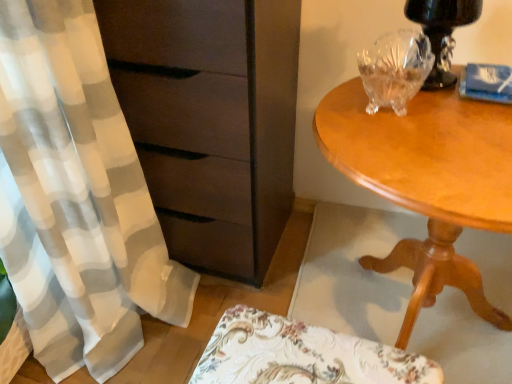
You are a GUI agent. You are given a task and a screenshot of the screen. Output one action in this format:
    pyautogui.click(x=<x>, y=<y>)
    Task: Click on the black glossy table lamp at upper right
    
    Given the screenshot: What is the action you would take?
    pyautogui.click(x=442, y=32)

What is the approximate width of floral fabric cushion at lower center?

floral fabric cushion at lower center is 17.35 centimeters in width.

What do you see at coordinates (426, 182) in the screenshot?
I see `light brown wood table at right` at bounding box center [426, 182].

Describe the element at coordinates (395, 69) in the screenshot. The height and width of the screenshot is (384, 512). I see `transparent crystal bowl at upper right` at that location.

Where is `black glossy table lamp at upper right`? This screenshot has height=384, width=512. black glossy table lamp at upper right is located at coordinates (442, 32).

Can you confirm if matte brown chest of drawers at left is smaller than floral fabric cushion at lower center?

No, matte brown chest of drawers at left is not smaller than floral fabric cushion at lower center.

Is matte brown chest of drawers at left directly adjacent to floral fabric cushion at lower center?

No, matte brown chest of drawers at left is not making contact with floral fabric cushion at lower center.

From a real-world perspective, who is located lower, matte brown chest of drawers at left or floral fabric cushion at lower center?

floral fabric cushion at lower center.

From a real-world perspective, is transparent crystal bowl at upper right above or below light brown wood table at right?

Clearly, from a real-world perspective, transparent crystal bowl at upper right is above light brown wood table at right.

Considering the sizes of objects transparent crystal bowl at upper right and light brown wood table at right in the image provided, who is bigger, transparent crystal bowl at upper right or light brown wood table at right?

light brown wood table at right is bigger.

Can you confirm if transparent crystal bowl at upper right is taller than light brown wood table at right?

In fact, transparent crystal bowl at upper right may be shorter than light brown wood table at right.

Find the location of `chest of drawers on the left of black glossy table lamp at upper right`. chest of drawers on the left of black glossy table lamp at upper right is located at coordinates (211, 121).

Based on the photo, does black glossy table lamp at upper right have a larger size compared to matte brown chest of drawers at left?

No.

Is black glossy table lamp at upper right positioned beyond the bounds of matte brown chest of drawers at left?

Absolutely, black glossy table lamp at upper right is external to matte brown chest of drawers at left.

Locate an element on the screen. This screenshot has width=512, height=384. table lamp above the floral fabric cushion at lower center (from the image's perspective) is located at coordinates (442, 32).

Is point (219, 369) less distant than point (413, 19)?

Yes.

Consider the image. Is floral fabric cushion at lower center spatially inside black glossy table lamp at upper right, or outside of it?

floral fabric cushion at lower center is located beyond the bounds of black glossy table lamp at upper right.

From the image's perspective, relative to black glossy table lamp at upper right, is floral fabric cushion at lower center above or below?

Clearly, from the image's perspective, floral fabric cushion at lower center is below black glossy table lamp at upper right.

Does light brown wood table at right come in front of matte brown chest of drawers at left?

Yes, the depth of light brown wood table at right is less than that of matte brown chest of drawers at left.

Does light brown wood table at right turn towards matte brown chest of drawers at left?

No, light brown wood table at right does not turn towards matte brown chest of drawers at left.

Can you confirm if light brown wood table at right is shorter than matte brown chest of drawers at left?

Yes.

How different are the orientations of light brown wood table at right and matte brown chest of drawers at left in degrees?

0.255 degrees.

Is black glossy table lamp at upper right placed right next to light brown wood table at right?

No, black glossy table lamp at upper right is not beside light brown wood table at right.

Considering the relative positions of black glossy table lamp at upper right and light brown wood table at right in the image provided, is black glossy table lamp at upper right to the right of light brown wood table at right from the viewer's perspective?

No, black glossy table lamp at upper right is not to the right of light brown wood table at right.

Is light brown wood table at right a part of black glossy table lamp at upper right?

No.

The image size is (512, 384). Identify the location of table lamp that is behind the light brown wood table at right. [442, 32].

Which object is wider, transparent crystal bowl at upper right or matte brown chest of drawers at left?

Result: With larger width is matte brown chest of drawers at left.

Between transparent crystal bowl at upper right and matte brown chest of drawers at left, which one appears on the right side from the viewer's perspective?

Positioned to the right is transparent crystal bowl at upper right.

Can we say transparent crystal bowl at upper right lies outside matte brown chest of drawers at left?

transparent crystal bowl at upper right lies outside matte brown chest of drawers at left's area.

Identify the location of swivel chair in front of the matte brown chest of drawers at left. (302, 355).

Where is `glass vase above the light brown wood table at right (from a real-world perspective)`? Image resolution: width=512 pixels, height=384 pixels. glass vase above the light brown wood table at right (from a real-world perspective) is located at coordinates (395, 69).

Which object lies nearer to the anchor point matte brown chest of drawers at left, black glossy table lamp at upper right or floral fabric cushion at lower center?

floral fabric cushion at lower center is closer to matte brown chest of drawers at left.

From the image, which object appears to be nearer to light brown wood table at right, black glossy table lamp at upper right or matte brown chest of drawers at left?

black glossy table lamp at upper right is positioned closer to the anchor light brown wood table at right.

Consider the image. Looking at the image, which one is located further to floral fabric cushion at lower center, transparent crystal bowl at upper right or matte brown chest of drawers at left?

Among the two, transparent crystal bowl at upper right is located further to floral fabric cushion at lower center.

Looking at the image, which one is located further to transparent crystal bowl at upper right, light brown wood table at right or matte brown chest of drawers at left?

matte brown chest of drawers at left is positioned further to the anchor transparent crystal bowl at upper right.

From the picture: From the image, which object appears to be farther from light brown wood table at right, transparent crystal bowl at upper right or matte brown chest of drawers at left?

matte brown chest of drawers at left is further to light brown wood table at right.

Looking at the image, which one is located closer to light brown wood table at right, matte brown chest of drawers at left or floral fabric cushion at lower center?

matte brown chest of drawers at left lies closer to light brown wood table at right than the other object.

Looking at the image, which one is located further to matte brown chest of drawers at left, transparent crystal bowl at upper right or light brown wood table at right?

transparent crystal bowl at upper right lies further to matte brown chest of drawers at left than the other object.

Based on their spatial positions, is black glossy table lamp at upper right or transparent crystal bowl at upper right closer to matte brown chest of drawers at left?

transparent crystal bowl at upper right is positioned closer to the anchor matte brown chest of drawers at left.

Locate an element on the screen. The image size is (512, 384). glass vase between matte brown chest of drawers at left and black glossy table lamp at upper right in the horizontal direction is located at coordinates (395, 69).

Identify the location of chest of drawers between transparent crystal bowl at upper right and floral fabric cushion at lower center in the up-down direction. (211, 121).

Locate an element on the screen. table lamp located between matte brown chest of drawers at left and light brown wood table at right in the left-right direction is located at coordinates (442, 32).

Where is `desk between black glossy table lamp at upper right and floral fabric cushion at lower center in the up-down direction`? The image size is (512, 384). desk between black glossy table lamp at upper right and floral fabric cushion at lower center in the up-down direction is located at coordinates (426, 182).